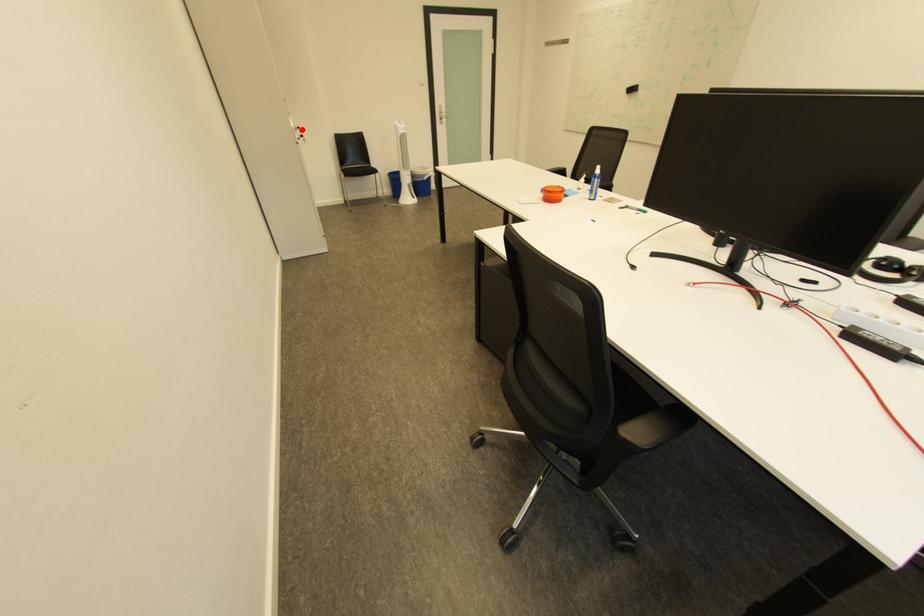
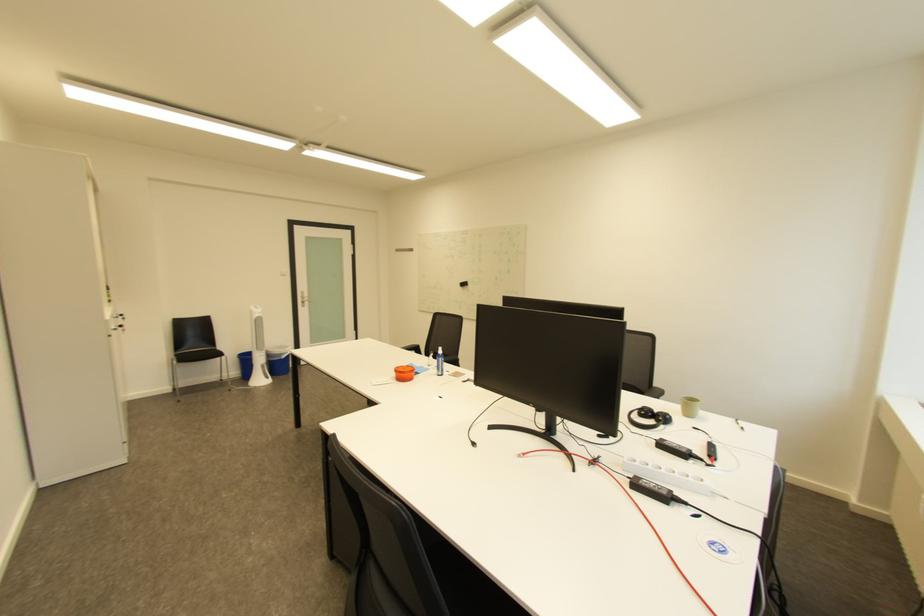
Question: I am providing you with two images of the same scene from different viewpoints. In image1, a red point is highlighted. Considering the same 3D point in image2, which of the following is correct?

Choices:
 (A) It is closer
 (B) It is farther

Answer: (B)